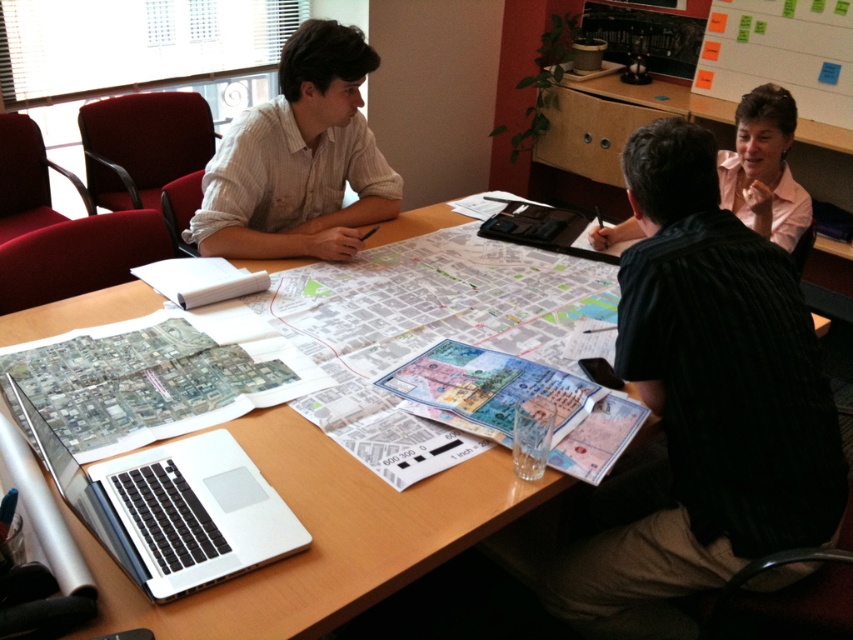
You are organizing a presentation and need to place both the silver metallic laptop at lower left and the black matte laptop at center on a narrow desk. Which laptop should you place first to ensure they both fit side by side?

The black matte laptop at center should be placed first since the silver metallic laptop at lower left is wider. Placing the wider laptop first ensures there is enough space for the narrower one next to it.

You are standing at the entrance of the meeting room and see the white striped shirt at upper left. Can you determine its exact location using the coordinate system provided?

The white striped shirt at upper left is located at point (x=299, y=160) in the coordinate system.

You are a participant in the meeting and need to refer to the transparent plastic map at lower left and the transparent plastic map at center. Which map is closer to the edge of the table?

The transparent plastic map at lower left is closer to the edge of the table because it is located above the transparent plastic map at center, which would place it nearer to the table edge.